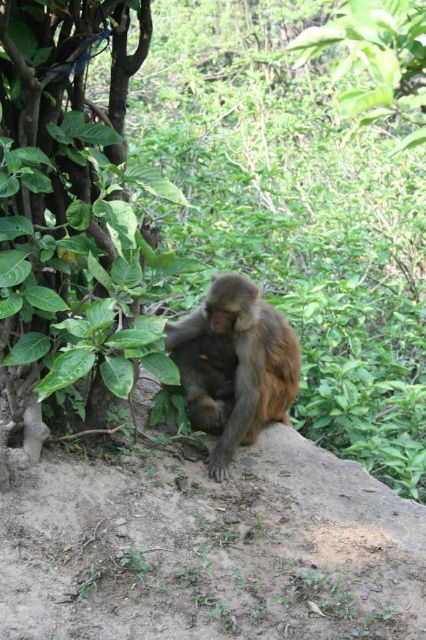
Is point (149, 266) positioned behind point (187, 316)?

No, (149, 266) is in front of (187, 316).

Can you confirm if green leafy tree at left is wider than brown furry monkey at center?

Correct, the width of green leafy tree at left exceeds that of brown furry monkey at center.

Between point (80, 348) and point (230, 364), which one is positioned in front?

Positioned in front is point (80, 348).

Where is `green leafy tree at left`? This screenshot has height=640, width=426. green leafy tree at left is located at coordinates (74, 212).